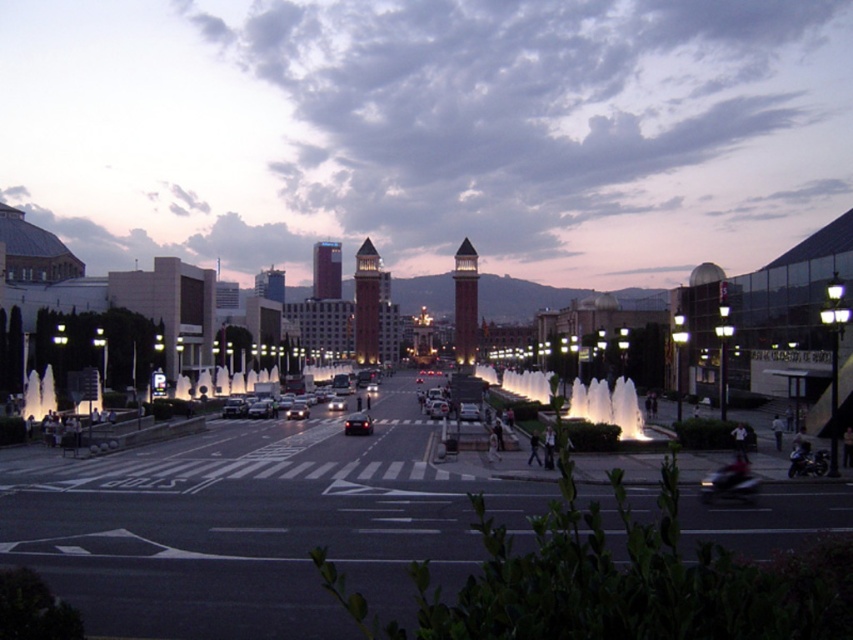
Is brown brick bell tower at center positioned behind shiny black car at center?

Yes, it is.

Is brown brick bell tower at center to the right of shiny black car at center from the viewer's perspective?

In fact, brown brick bell tower at center is to the left of shiny black car at center.

At what (x,y) coordinates should I click in order to perform the action: click on brown brick bell tower at center. Please return your answer as a coordinate pair (x, y). Looking at the image, I should click on (366, 304).

Which is more to the right, brown brick bell tower at center or brick stone bell tower at center?

brick stone bell tower at center

Which of these two, brown brick bell tower at center or brick stone bell tower at center, stands taller?

With more height is brick stone bell tower at center.

Which is in front, point (370, 246) or point (457, 298)?

Positioned in front is point (370, 246).

The height and width of the screenshot is (640, 853). Identify the location of brown brick bell tower at center. (366, 304).

Between black asphalt road at center and brown brick bell tower at center, which one is positioned lower?

black asphalt road at center is lower down.

Is point (273, 561) behind point (366, 323)?

No.

Is point (215, 554) behind point (378, 301)?

No, it is not.

Find the location of a particular element. The width and height of the screenshot is (853, 640). black asphalt road at center is located at coordinates (258, 524).